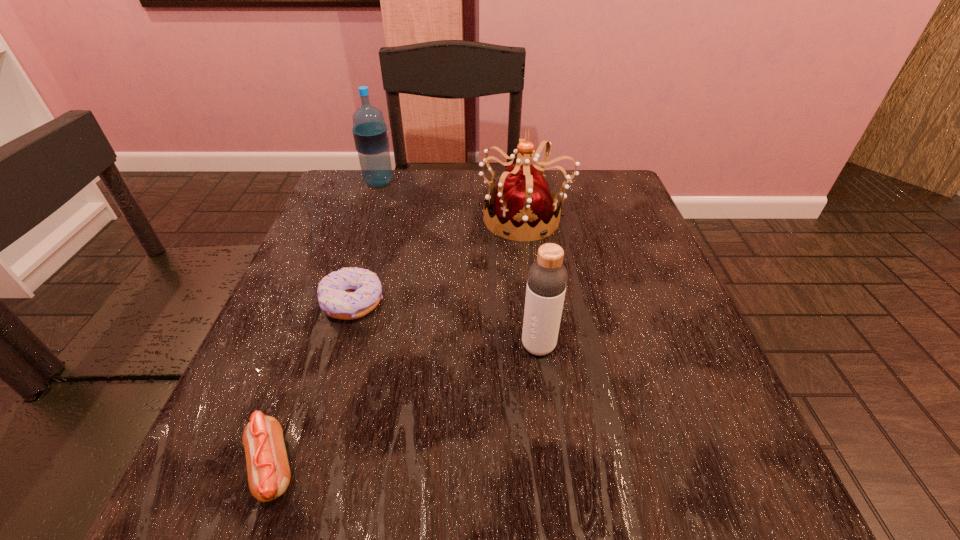
Where is `the farthest object`? This screenshot has height=540, width=960. the farthest object is located at coordinates (370, 132).

The width and height of the screenshot is (960, 540). What are the coordinates of `tiara` in the screenshot? It's located at (523, 204).

Where is `the fourth farthest object`? the fourth farthest object is located at coordinates (547, 278).

This screenshot has width=960, height=540. Find the location of `the third farthest object`. the third farthest object is located at coordinates (350, 293).

Find the location of a particular element. The width and height of the screenshot is (960, 540). the nearest object is located at coordinates (268, 469).

This screenshot has width=960, height=540. I want to click on free space located on the front of the water bottle, so click(x=347, y=279).

This screenshot has height=540, width=960. Find the location of `free spot located on the front-facing side of the tiara`. free spot located on the front-facing side of the tiara is located at coordinates (389, 218).

The width and height of the screenshot is (960, 540). Find the location of `free location located 0.160m on the front-facing side of the tiara`. free location located 0.160m on the front-facing side of the tiara is located at coordinates (x=410, y=218).

Find the location of a particular element. The height and width of the screenshot is (540, 960). free region located 0.300m on the front-facing side of the tiara is located at coordinates (349, 218).

Locate an element on the screen. The image size is (960, 540). free space located 0.400m on the left of the bottle is located at coordinates (283, 346).